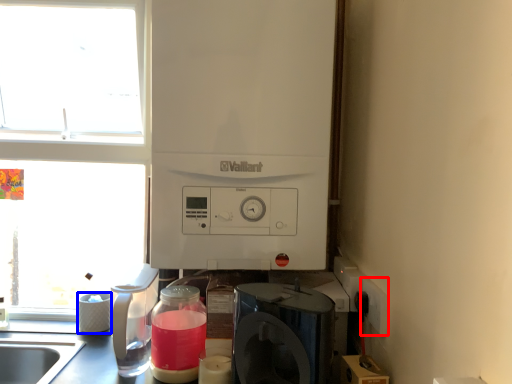
Question: Among these objects, which one is farthest to the camera, electric outlet (highlighted by a red box) or appliance (highlighted by a blue box)?

Choices:
 (A) electric outlet
 (B) appliance

Answer: (B)